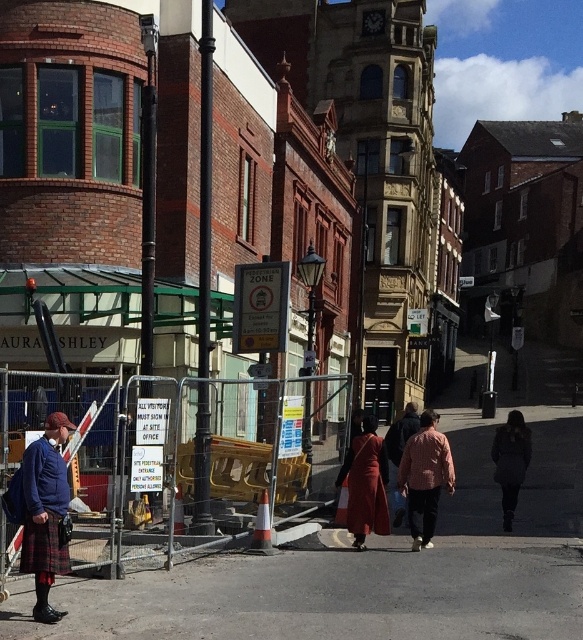
Consider the image. You are a pedestrian standing on the gray asphalt pavement at lower center and want to reach a friend waiting at the matte red dress at center. The construction site has a rule that you must stay at least 3 meters away from any active work zones. Can you safely walk directly to your friend without violating the rule?

The distance between the gray asphalt pavement at lower center and the matte red dress at center is 2.54 meters. Since the required minimum distance from active work zones is 3 meters, walking directly would bring you closer than allowed. Therefore, you cannot safely walk to your friend without violating the rule.

You are a delivery driver who needs to park your van near the construction site. The van requires a parking spot that is at least 5 meters away from the red plaid shirt at center. Is the parking spot at coordinates point 0.747, 0.729 suitable?

The parking spot at coordinates point (424, 477) is exactly where the red plaid shirt at center is located, so it is not suitable as it does not meet the requirement of being at least 5 meters away.

You are a pedestrian standing at the construction site and want to cross the street. You see two points marked on the ground, point (329, 556) and point (336, 476). Which point is closer to the direction you are facing?

Point (329, 556) is in front of point 0.745, 0.745, so the closer point to your facing direction is point (329, 556).